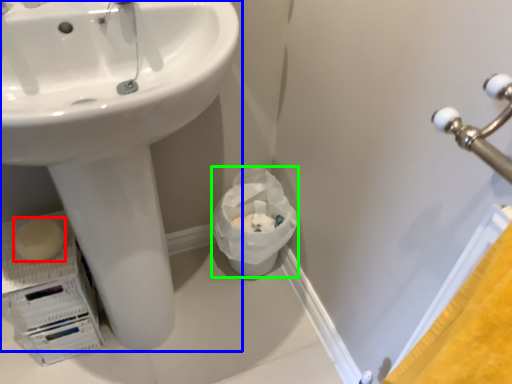
Question: Which object is positioned farthest from soap (highlighted by a red box)? Select from sink (highlighted by a blue box) and garbage (highlighted by a green box).

Choices:
 (A) sink
 (B) garbage

Answer: (B)